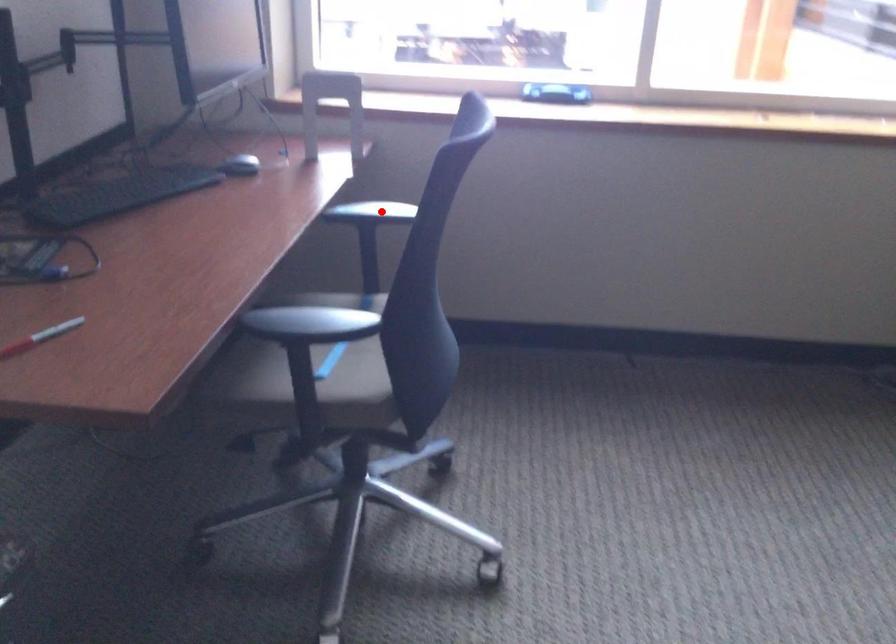
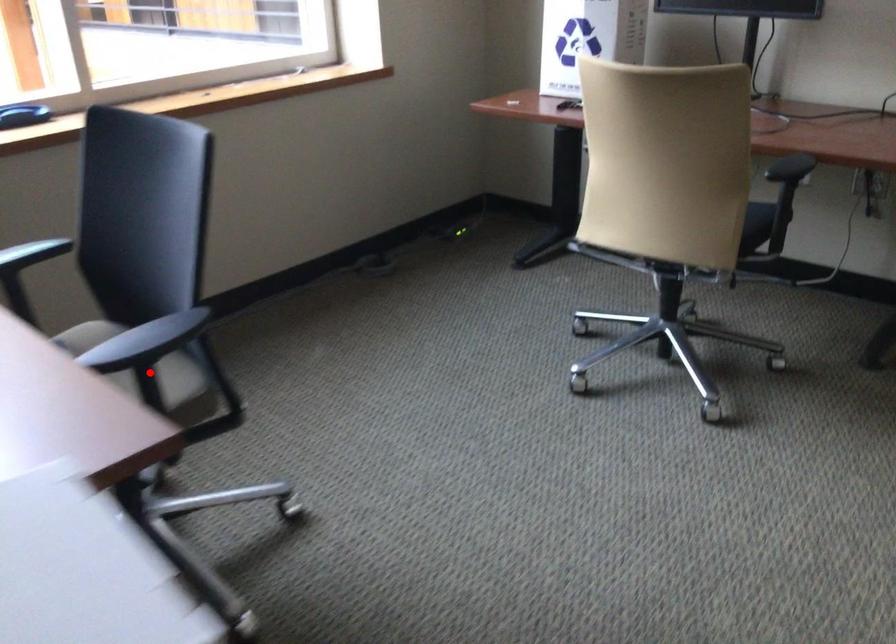
I am providing you with two images of the same scene from different viewpoints. A red point is marked on the first image and another point is marked on the second image. Is the red point in image1 aligned with the point shown in image2?

No